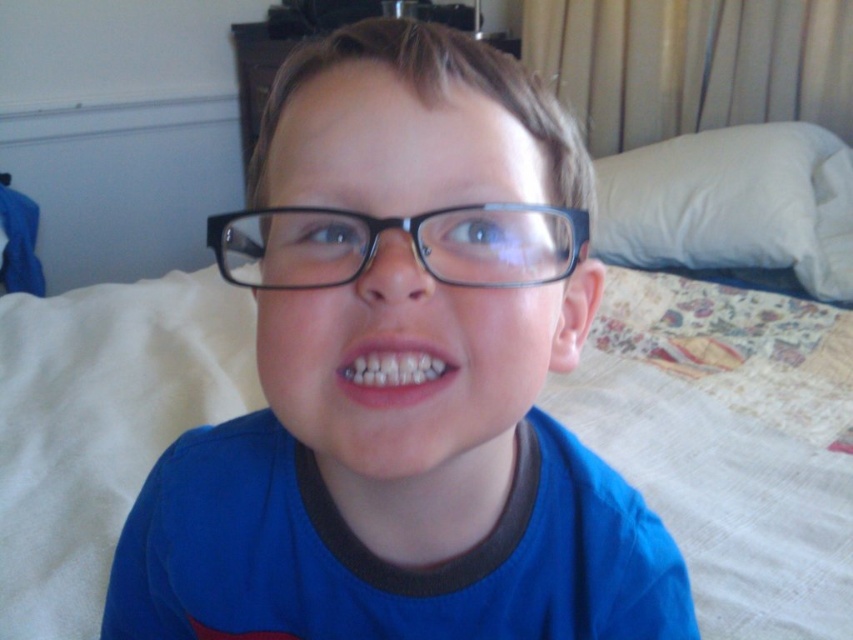
You are taking a photo of the boy and notice two points in the image. One is at coordinate point (770, 636) and the other at point (236, 244). Which point is closer to the camera?

Point (236, 244) is closer to the camera than point (770, 636) because the description states that point (770, 636) is further away.

You are an interior designer planning to hang a picture frame at coordinate point 0.634, 0.477. The blue matte shirt at center is currently occupying that spot. What should you do?

The blue matte shirt at center is at point (405,404), so you should move the blue matte shirt at center to another location before hanging the picture frame there.

You are a delivery person who needs to place a small package between the white fabric bed at center and the black plastic glasses at center. The package requires 12 inches of space. Is there enough space between them?

The white fabric bed at center is 35.47 inches away from the black plastic glasses at center, so yes, there is enough space to place the package between them since 35.47 inches is greater than the required 12 inches.